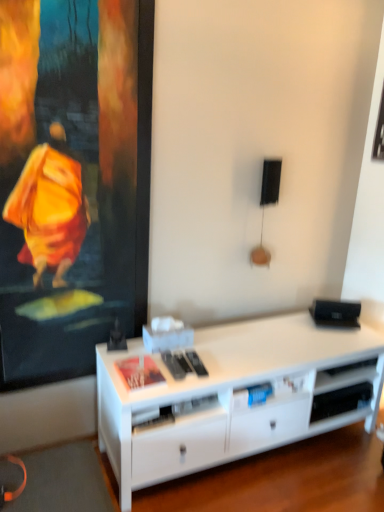
The height and width of the screenshot is (512, 384). Find the location of `white matte desk at center`. white matte desk at center is located at coordinates (232, 396).

The width and height of the screenshot is (384, 512). What do you see at coordinates (232, 396) in the screenshot?
I see `white matte desk at center` at bounding box center [232, 396].

Describe the element at coordinates (343, 390) in the screenshot. The height and width of the screenshot is (512, 384). I see `white matte shelf at lower right` at that location.

The image size is (384, 512). I want to click on white matte shelf at lower right, so click(343, 390).

At what (x,y) coordinates should I click in order to perform the action: click on white matte desk at center. Please return your answer as a coordinate pair (x, y). Image resolution: width=384 pixels, height=512 pixels. Looking at the image, I should click on [x=232, y=396].

Considering the relative positions of white matte desk at center and white matte shelf at lower right in the image provided, is white matte desk at center to the left or to the right of white matte shelf at lower right?

white matte desk at center is to the left of white matte shelf at lower right.

Consider the image. Is the position of white matte desk at center more distant than that of white matte shelf at lower right?

No, white matte desk at center is closer to the camera.

Between point (261, 423) and point (336, 393), which one is positioned behind?

Point (336, 393)

Looking at this image, from the image's perspective, does white matte desk at center appear lower than white matte shelf at lower right?

Actually, white matte desk at center appears above white matte shelf at lower right in the image.

From a real-world perspective, who is located lower, white matte desk at center or white matte shelf at lower right?

In real-world perspective, white matte shelf at lower right is lower.

Considering the sizes of objects white matte desk at center and white matte shelf at lower right in the image provided, who is thinner, white matte desk at center or white matte shelf at lower right?

white matte shelf at lower right is thinner.

Does white matte desk at center have a greater height compared to white matte shelf at lower right?

Yes, white matte desk at center is taller than white matte shelf at lower right.

Who is bigger, white matte desk at center or white matte shelf at lower right?

white matte desk at center.

Is white matte shelf at lower right completely or partially inside white matte desk at center?

Indeed, white matte shelf at lower right is located within white matte desk at center.

Consider the image. Is white matte desk at center in contact with white matte shelf at lower right?

white matte desk at center is not next to white matte shelf at lower right, and they're not touching.

Consider the image. Is white matte desk at center turned away from white matte shelf at lower right?

Yes.

Measure the distance from white matte desk at center to white matte shelf at lower right.

white matte desk at center and white matte shelf at lower right are 12.92 inches apart from each other.

In the image, there is a white matte desk at center. Where is `shelf below it (from a real-world perspective)`? shelf below it (from a real-world perspective) is located at coordinates (343, 390).

Considering the positions of objects white matte shelf at lower right and white matte desk at center in the image provided, who is more to the right, white matte shelf at lower right or white matte desk at center?

white matte shelf at lower right.

Which is behind, white matte shelf at lower right or white matte desk at center?

white matte shelf at lower right is further away from the camera.

Does point (356, 370) lie behind point (173, 354)?

Yes, point (356, 370) is behind point (173, 354).

From the image's perspective, would you say white matte shelf at lower right is shown under white matte desk at center?

Yes, from the image's perspective, white matte shelf at lower right is beneath white matte desk at center.

From the picture: From a real-world perspective, is white matte shelf at lower right above or below white matte desk at center?

Clearly, from a real-world perspective, white matte shelf at lower right is below white matte desk at center.

In the scene shown: Which of these two, white matte shelf at lower right or white matte desk at center, is thinner?

white matte shelf at lower right is thinner.

From the picture: Considering the sizes of objects white matte shelf at lower right and white matte desk at center in the image provided, who is taller, white matte shelf at lower right or white matte desk at center?

Standing taller between the two is white matte desk at center.

Considering the sizes of objects white matte shelf at lower right and white matte desk at center in the image provided, who is bigger, white matte shelf at lower right or white matte desk at center?

Bigger between the two is white matte desk at center.

Does white matte shelf at lower right contain white matte desk at center?

No, white matte desk at center is not surrounded by white matte shelf at lower right.

Is white matte shelf at lower right not near white matte desk at center?

No, white matte shelf at lower right is not far from white matte desk at center.

Is white matte shelf at lower right looking in the opposite direction of white matte desk at center?

Yes, white matte shelf at lower right is facing away from white matte desk at center.

Measure the distance from white matte shelf at lower right to white matte desk at center.

white matte shelf at lower right is 12.92 inches from white matte desk at center.

I want to click on desk above the white matte shelf at lower right (from the image's perspective), so click(x=232, y=396).

You are a GUI agent. You are given a task and a screenshot of the screen. Output one action in this format:
    pyautogui.click(x=<x>, y=<y>)
    Task: Click on the desk above the white matte shelf at lower right (from a real-world perspective)
    The width and height of the screenshot is (384, 512).
    Given the screenshot: What is the action you would take?
    pyautogui.click(x=232, y=396)

Locate an element on the screen. The width and height of the screenshot is (384, 512). desk in front of the white matte shelf at lower right is located at coordinates (232, 396).